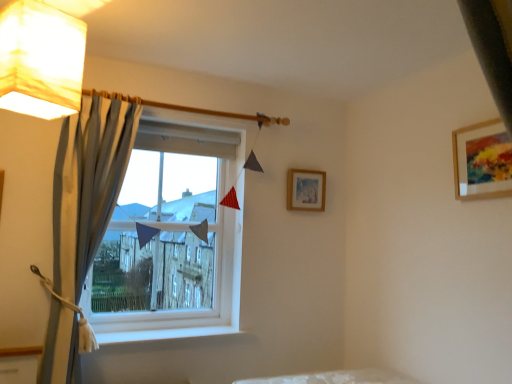
Question: From the image's perspective, is wooden-framed artwork at upper right, positioned as the second picture frame in left-to-right order, above or below white smooth window sill at lower center?

Choices:
 (A) above
 (B) below

Answer: (A)

Question: In the image, is wooden-framed artwork at upper right, positioned as the second picture frame in left-to-right order, positioned in front of or behind white smooth window sill at lower center?

Choices:
 (A) front
 (B) behind

Answer: (A)

Question: Which of these objects is positioned farthest from the white smooth window sill at lower center?

Choices:
 (A) white paper lampshade at upper left
 (B) wooden picture frame at upper right, positioned as the 2th picture frame in right-to-left order
 (C) wooden-framed artwork at upper right, positioned as the second picture frame in left-to-right order
 (D) blue striped curtain at left
 (E) white plastic window at center

Answer: (C)

Question: Which object is positioned closest to the white paper lampshade at upper left?

Choices:
 (A) wooden-framed artwork at upper right, positioned as the second picture frame in left-to-right order
 (B) white plastic window at center
 (C) wooden picture frame at upper right, acting as the 1th picture frame starting from the back
 (D) blue striped curtain at left
 (E) white smooth window sill at lower center

Answer: (D)